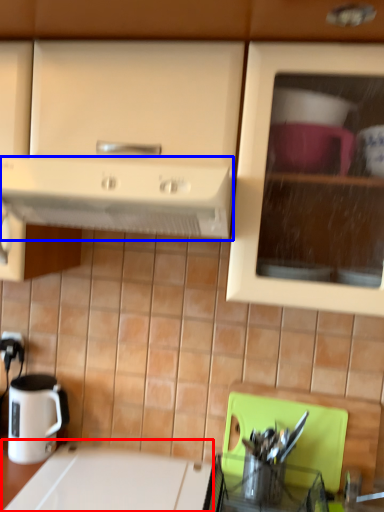
Question: Which object is closer to the camera taking this photo, counter top (highlighted by a red box) or kitchen appliance (highlighted by a blue box)?

Choices:
 (A) counter top
 (B) kitchen appliance

Answer: (B)